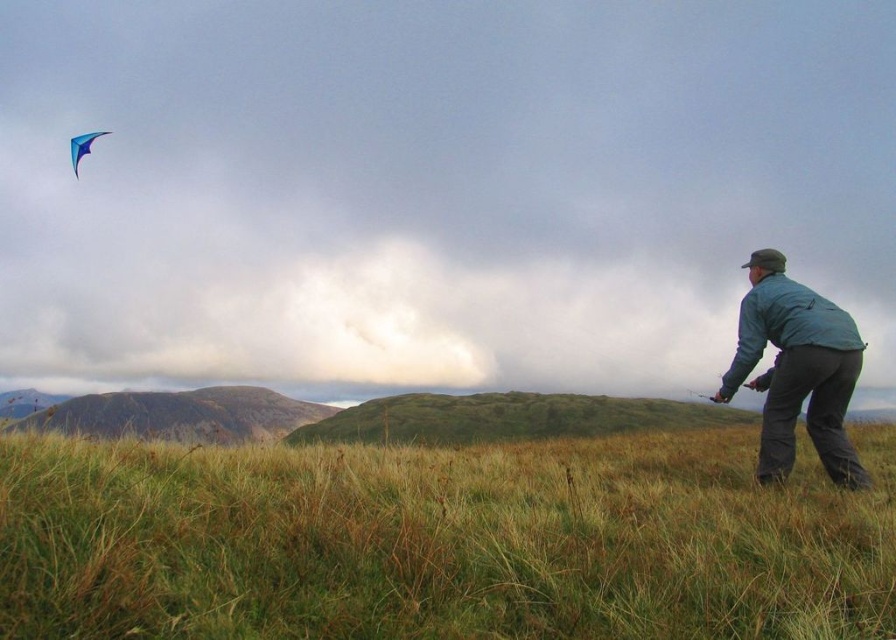
Can you confirm if green matte jacket at right is shorter than blue glossy kite at upper left?

In fact, green matte jacket at right may be taller than blue glossy kite at upper left.

Can you confirm if green matte jacket at right is bigger than blue glossy kite at upper left?

No, green matte jacket at right is not bigger than blue glossy kite at upper left.

The image size is (896, 640). Identify the location of green matte jacket at right. (797, 369).

Who is positioned more to the left, green grassy field at lower right or green matte jacket at right?

green grassy field at lower right

Is green grassy field at lower right to the right of green matte jacket at right from the viewer's perspective?

No, green grassy field at lower right is not to the right of green matte jacket at right.

Locate an element on the screen. green grassy field at lower right is located at coordinates (442, 541).

Is green grassy field at lower right wider than blue glossy kite at upper left?

In fact, green grassy field at lower right might be narrower than blue glossy kite at upper left.

Who is shorter, green grassy field at lower right or blue glossy kite at upper left?

green grassy field at lower right

What do you see at coordinates (442, 541) in the screenshot? The width and height of the screenshot is (896, 640). I see `green grassy field at lower right` at bounding box center [442, 541].

In order to click on green grassy field at lower right in this screenshot , I will do `click(442, 541)`.